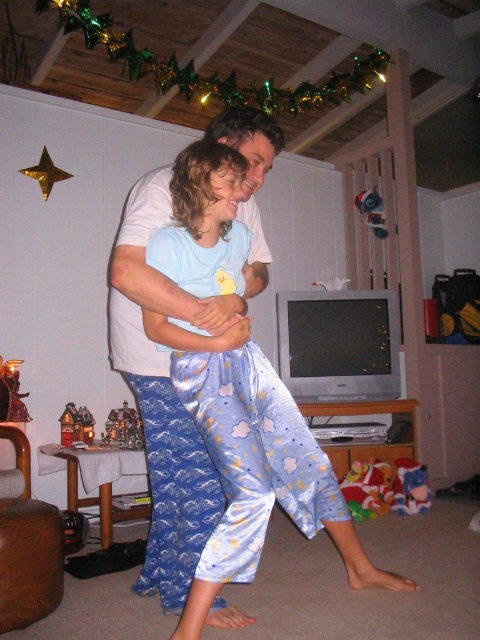
Question: Which point is farther to the camera?

Choices:
 (A) (145, 259)
 (B) (256, 260)

Answer: (B)

Question: Is blue satin pajama pants at center in front of blue satin pajamas at center?

Choices:
 (A) no
 (B) yes

Answer: (B)

Question: In this image, where is blue satin pajama pants at center located relative to blue satin pajamas at center?

Choices:
 (A) right
 (B) left

Answer: (A)

Question: Where is blue satin pajama pants at center located in relation to blue satin pajamas at center in the image?

Choices:
 (A) below
 (B) above

Answer: (A)